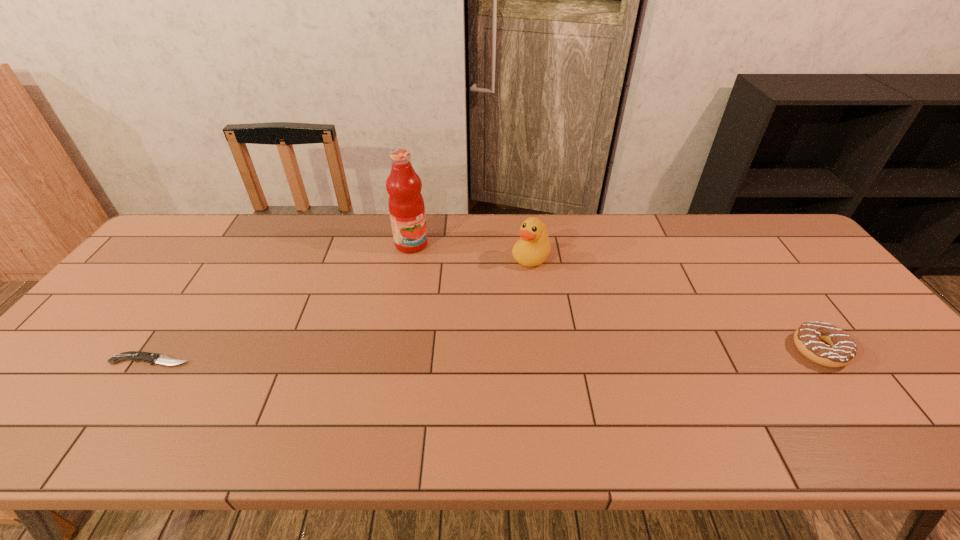
Image resolution: width=960 pixels, height=540 pixels. Identify the location of the shortest object. (152, 358).

Find the location of a particular element. This screenshot has height=540, width=960. pocketknife is located at coordinates (152, 358).

Locate an element on the screen. Image resolution: width=960 pixels, height=540 pixels. doughnut is located at coordinates (822, 343).

Find the location of a particular element. the rightmost object is located at coordinates (822, 343).

The height and width of the screenshot is (540, 960). I want to click on the third object from right to left, so click(406, 205).

The image size is (960, 540). Find the location of `the tallest object`. the tallest object is located at coordinates (406, 205).

Where is `the second object from right to left`? The width and height of the screenshot is (960, 540). the second object from right to left is located at coordinates (533, 248).

Image resolution: width=960 pixels, height=540 pixels. Identify the location of duck. (533, 248).

Identify the location of vacant space situated 0.050m on the left of the leftmost object. (91, 361).

At what (x,y) coordinates should I click in order to perform the action: click on free point located on the back of the doughnut. Please return your answer as a coordinate pair (x, y). Looking at the image, I should click on (761, 270).